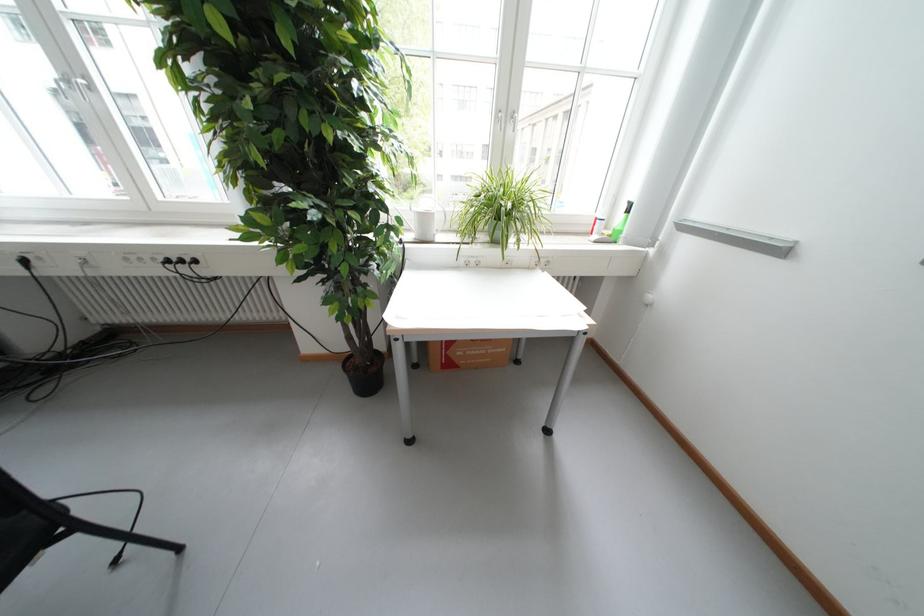
The location [621,223] corresponds to which object?

This point indicates the green glass bottle.